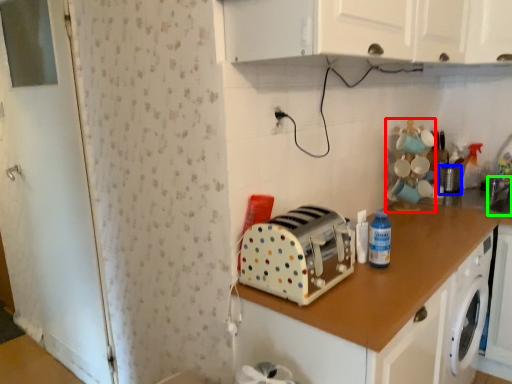
Question: Considering the real-world distances, which object is closest to toy (highlighted by a red box)? appliance (highlighted by a blue box) or sink (highlighted by a green box).

Choices:
 (A) appliance
 (B) sink

Answer: (A)